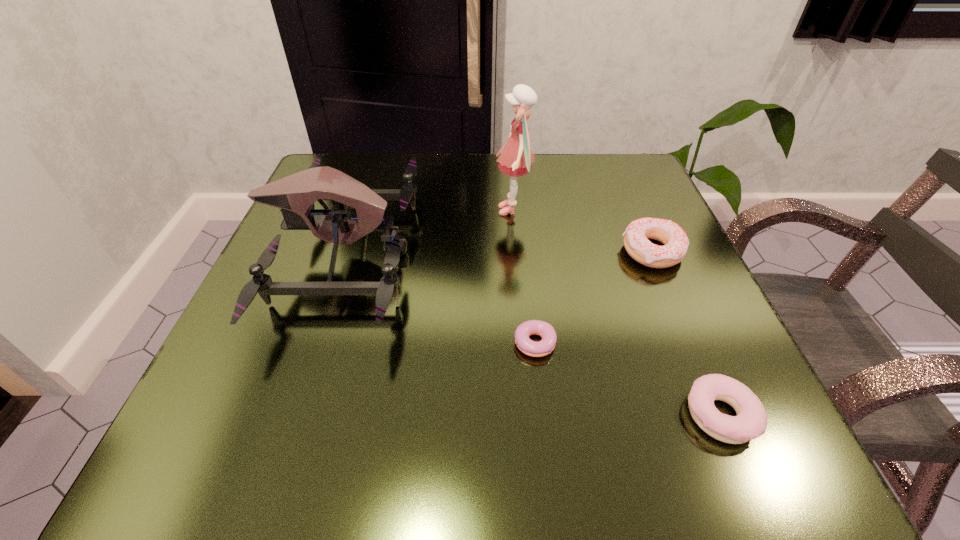
Locate an element on the screen. Image resolution: width=960 pixels, height=540 pixels. the tallest object is located at coordinates [516, 159].

This screenshot has width=960, height=540. What are the coordinates of `drone` in the screenshot? It's located at (295, 194).

The height and width of the screenshot is (540, 960). Identify the location of the second tallest object. (295, 194).

What are the coordinates of `the farthest doughnut` in the screenshot? It's located at (637, 233).

Identify the location of the tallest doughnut. (637, 233).

At what (x,y) coordinates should I click in order to perform the action: click on the fourth tallest object. Please return your answer as a coordinate pair (x, y). This screenshot has height=540, width=960. Looking at the image, I should click on pos(751,421).

You are a GUI agent. You are given a task and a screenshot of the screen. Output one action in this format:
    pyautogui.click(x=<x>, y=<y>)
    Task: Click on the second shortest doughnut
    This screenshot has width=960, height=540.
    Given the screenshot: What is the action you would take?
    pyautogui.click(x=751, y=421)

The image size is (960, 540). Identify the location of the leftmost doughnut. (529, 347).

Find the location of a particular element. This screenshot has height=540, width=960. the shortest doughnut is located at coordinates (529, 347).

Where is `free space located on the front-facing side of the tallest object`? This screenshot has height=540, width=960. free space located on the front-facing side of the tallest object is located at coordinates (390, 210).